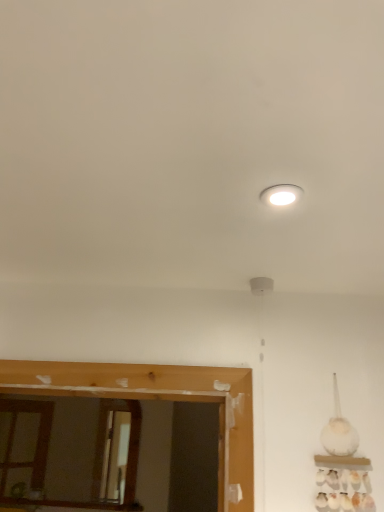
In the scene shown: What is the approximate width of wooden mirror at lower left?

wooden mirror at lower left is 2.56 inches wide.

Describe the element at coordinates (70, 451) in the screenshot. The height and width of the screenshot is (512, 384). I see `wooden mirror at lower left` at that location.

Where is `wooden mirror at lower left`? wooden mirror at lower left is located at coordinates (70, 451).

The width and height of the screenshot is (384, 512). I want to click on white glossy light fixture at upper center, so click(x=280, y=195).

Describe the element at coordinates (280, 195) in the screenshot. Image resolution: width=384 pixels, height=512 pixels. I see `white glossy light fixture at upper center` at that location.

Find the location of a particular element. wooden mirror at lower left is located at coordinates (70, 451).

Which is more to the right, wooden mirror at lower left or white glossy light fixture at upper center?

From the viewer's perspective, white glossy light fixture at upper center appears more on the right side.

Considering the positions of objects wooden mirror at lower left and white glossy light fixture at upper center in the image provided, who is behind, wooden mirror at lower left or white glossy light fixture at upper center?

wooden mirror at lower left is further away from the camera.

Between point (184, 462) and point (283, 190), which one is positioned behind?

Positioned behind is point (184, 462).

From the image's perspective, who appears lower, wooden mirror at lower left or white glossy light fixture at upper center?

From the image's view, wooden mirror at lower left is below.

From a real-world perspective, is wooden mirror at lower left above or below white glossy light fixture at upper center?

wooden mirror at lower left is below white glossy light fixture at upper center.

Based on the photo, does wooden mirror at lower left have a greater width compared to white glossy light fixture at upper center?

Incorrect, the width of wooden mirror at lower left does not surpass that of white glossy light fixture at upper center.

Can you confirm if wooden mirror at lower left is taller than white glossy light fixture at upper center?

Yes.

Can you confirm if wooden mirror at lower left is smaller than white glossy light fixture at upper center?

Actually, wooden mirror at lower left might be larger than white glossy light fixture at upper center.

Is wooden mirror at lower left positioned beyond the bounds of white glossy light fixture at upper center?

Absolutely, wooden mirror at lower left is external to white glossy light fixture at upper center.

Consider the image. Are wooden mirror at lower left and white glossy light fixture at upper center making contact?

No, wooden mirror at lower left is not in contact with white glossy light fixture at upper center.

Is wooden mirror at lower left positioned with its back to white glossy light fixture at upper center?

No.

How many degrees apart are the facing directions of wooden mirror at lower left and white glossy light fixture at upper center?

wooden mirror at lower left and white glossy light fixture at upper center are facing 0.68 degrees away from each other.

The width and height of the screenshot is (384, 512). What are the coordinates of `mirror below the white glossy light fixture at upper center (from the image's perspective)` in the screenshot? It's located at (70, 451).

Considering the relative positions of white glossy light fixture at upper center and wooden mirror at lower left in the image provided, is white glossy light fixture at upper center to the left of wooden mirror at lower left from the viewer's perspective?

No.

Which is in front, white glossy light fixture at upper center or wooden mirror at lower left?

white glossy light fixture at upper center.

Considering the positions of points (294, 188) and (10, 397), is point (294, 188) farther from camera compared to point (10, 397)?

No, it is in front of (10, 397).

From the image's perspective, who appears lower, white glossy light fixture at upper center or wooden mirror at lower left?

From the image's view, wooden mirror at lower left is below.

From a real-world perspective, is white glossy light fixture at upper center physically located above or below wooden mirror at lower left?

From a real-world perspective, white glossy light fixture at upper center is physically above wooden mirror at lower left.

Which object is wider, white glossy light fixture at upper center or wooden mirror at lower left?

With larger width is white glossy light fixture at upper center.

Is white glossy light fixture at upper center taller than wooden mirror at lower left?

No, white glossy light fixture at upper center is not taller than wooden mirror at lower left.

Who is smaller, white glossy light fixture at upper center or wooden mirror at lower left?

Smaller between the two is white glossy light fixture at upper center.

Is white glossy light fixture at upper center inside the boundaries of wooden mirror at lower left, or outside?

The correct answer is: outside.

Is white glossy light fixture at upper center next to wooden mirror at lower left?

No, white glossy light fixture at upper center is not making contact with wooden mirror at lower left.

Could you tell me if white glossy light fixture at upper center is turned towards wooden mirror at lower left?

No, white glossy light fixture at upper center is not turned towards wooden mirror at lower left.

What's the angular difference between white glossy light fixture at upper center and wooden mirror at lower left's facing directions?

The facing directions of white glossy light fixture at upper center and wooden mirror at lower left are 0.68 degrees apart.

Locate an element on the screen. mirror that is on the left side of white glossy light fixture at upper center is located at coordinates (70, 451).

You are a GUI agent. You are given a task and a screenshot of the screen. Output one action in this format:
    pyautogui.click(x=<x>, y=<y>)
    Task: Click on the mirror located underneath the white glossy light fixture at upper center (from a real-world perspective)
    
    Given the screenshot: What is the action you would take?
    pyautogui.click(x=70, y=451)

Locate an element on the screen. The image size is (384, 512). lighting above the wooden mirror at lower left (from the image's perspective) is located at coordinates (280, 195).